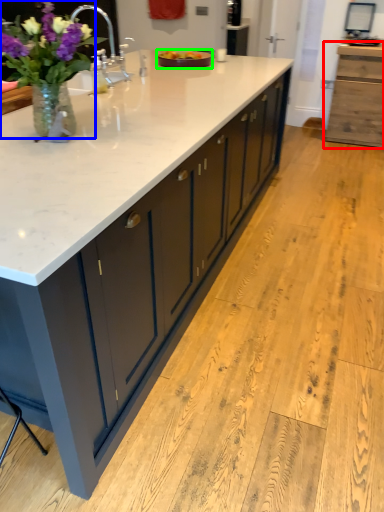
Question: Estimate the real-world distances between objects in this image. Which object is farther from cabinetry (highlighted by a red box), houseplant (highlighted by a blue box) or tray (highlighted by a green box)?

Choices:
 (A) houseplant
 (B) tray

Answer: (A)